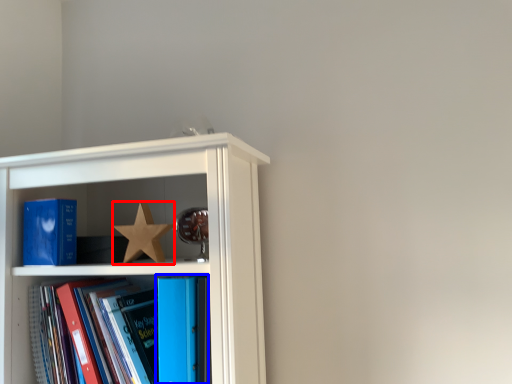
Question: Which point is closer to the camera, star (highlighted by a red box) or book (highlighted by a blue box)?

Choices:
 (A) star
 (B) book

Answer: (B)